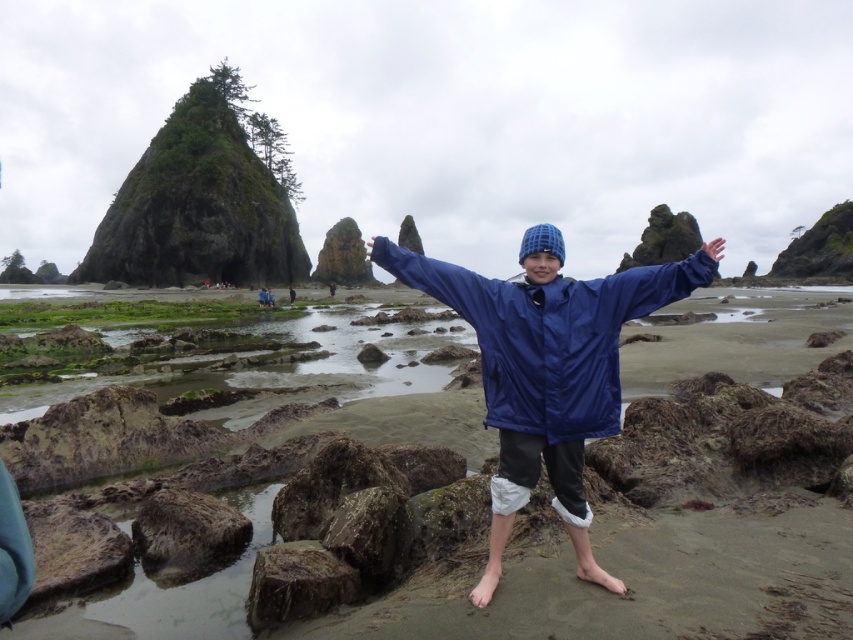
Question: Which point appears farthest from the camera in this image?

Choices:
 (A) (709, 257)
 (B) (323, 328)

Answer: (B)

Question: Estimate the real-world distances between objects in this image. Which object is farther from the blue shiny jacket at center?

Choices:
 (A) blue fabric jacket at center
 (B) blue fabric hand at upper center

Answer: (A)

Question: Can you confirm if blue fabric jacket at center is positioned to the left of blue fabric hand at upper center?

Choices:
 (A) no
 (B) yes

Answer: (A)

Question: Is blue fabric jacket at center to the right of blue shiny jacket at center from the viewer's perspective?

Choices:
 (A) yes
 (B) no

Answer: (A)

Question: Which point is farther to the camera?

Choices:
 (A) (711, 241)
 (B) (404, 364)
 (C) (578, 406)

Answer: (B)

Question: Does blue fabric jacket at center appear on the right side of blue shiny jacket at center?

Choices:
 (A) yes
 (B) no

Answer: (A)